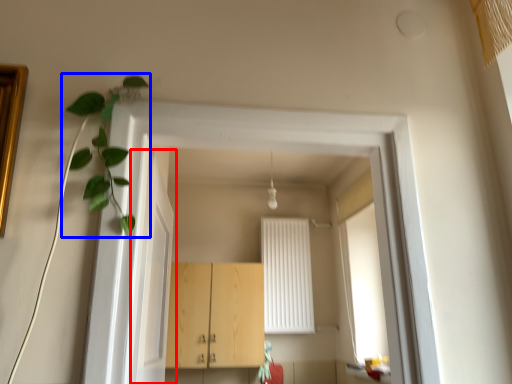
Question: Which point is closer to the camera, door (highlighted by a red box) or plant (highlighted by a blue box)?

Choices:
 (A) door
 (B) plant

Answer: (B)